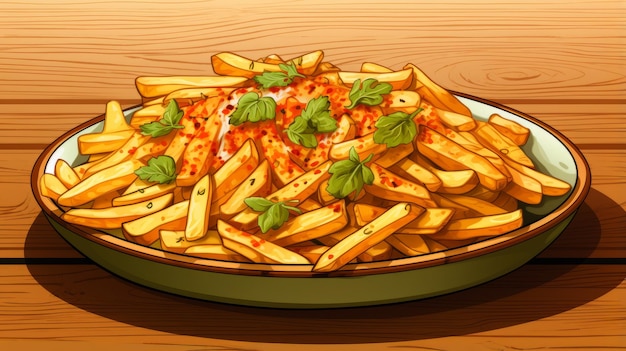
The image size is (626, 351). What are the coordinates of `bowl rim` in the screenshot? It's located at (561, 211).